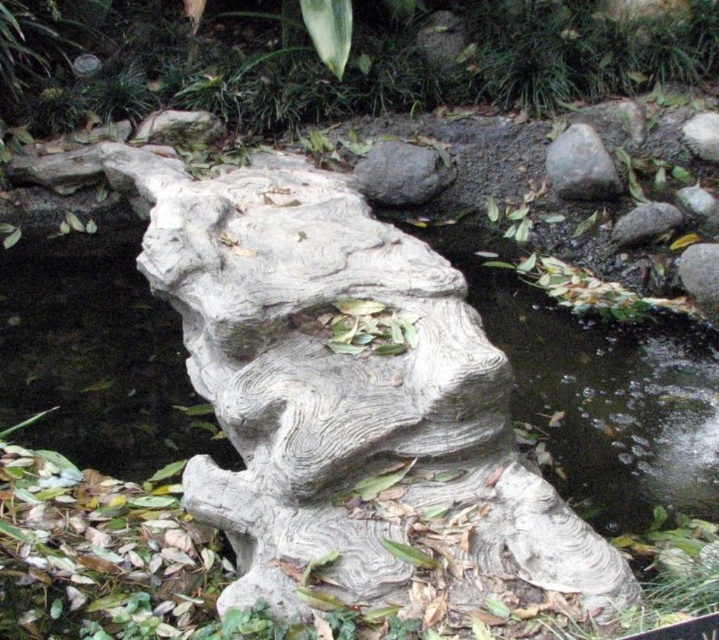
Can you confirm if gray wood log at center is positioned below gray rough stone at lower right?

Indeed, gray wood log at center is positioned under gray rough stone at lower right.

Consider the image. Is gray wood log at center bigger than gray rough stone at lower right?

No.

Where is `gray wood log at center`? This screenshot has width=719, height=640. gray wood log at center is located at coordinates (700, 276).

Is gray rough rock at upper center thinner than gray rough rock at upper right?

No.

Which is above, gray rough rock at upper center or gray rough rock at upper right?

gray rough rock at upper center is above.

Between point (423, 186) and point (585, 180), which one is positioned in front?

Point (585, 180) is more forward.

The image size is (719, 640). What are the coordinates of `gray rough rock at upper center` in the screenshot? It's located at (400, 172).

Consider the image. Who is lower down, gray rough rock at upper center or gray wood log at center?

Positioned lower is gray wood log at center.

Between point (411, 173) and point (709, 300), which one is positioned behind?

Point (411, 173)

Find the location of a particular element. The image size is (719, 640). gray rough rock at upper center is located at coordinates (400, 172).